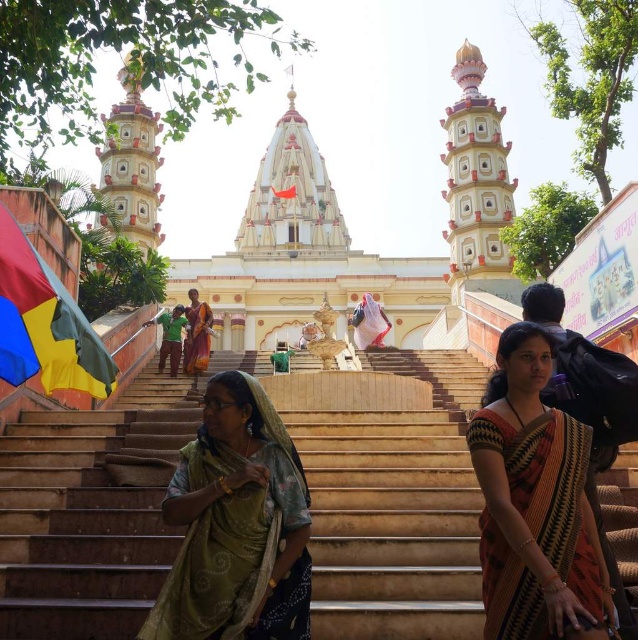
Question: Which of the following is the closest to the observer?

Choices:
 (A) orange fabric saree at center
 (B) green fabric at center
 (C) beige stone stairs at center

Answer: (C)

Question: Which point appears farthest from the camera in this image?

Choices:
 (A) (244, 628)
 (B) (590, 547)

Answer: (A)

Question: Can you confirm if orange fabric saree at center is thinner than red fabric flag at center?

Choices:
 (A) no
 (B) yes

Answer: (B)

Question: Can you confirm if green silk saree at center is positioned above white fabric flag at center?

Choices:
 (A) no
 (B) yes

Answer: (A)

Question: Which object appears closest to the camera in this image?

Choices:
 (A) beige stone stairs at center
 (B) red fabric flag at center
 (C) multicolored fabric flag at left
 (D) white fabric flag at center

Answer: (A)

Question: Is multicolored fabric flag at left smaller than white fabric flag at center?

Choices:
 (A) no
 (B) yes

Answer: (B)